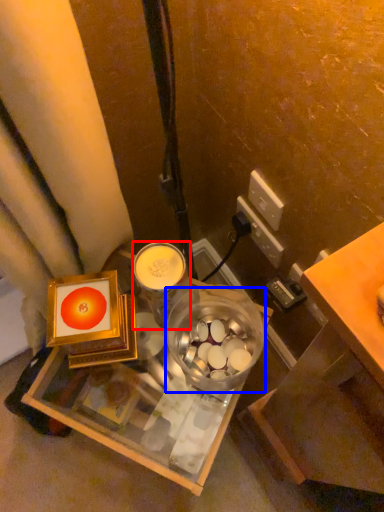
Question: Which object is further to the camera taking this photo, coffee cup (highlighted by a red box) or glass bowl (highlighted by a blue box)?

Choices:
 (A) coffee cup
 (B) glass bowl

Answer: (A)